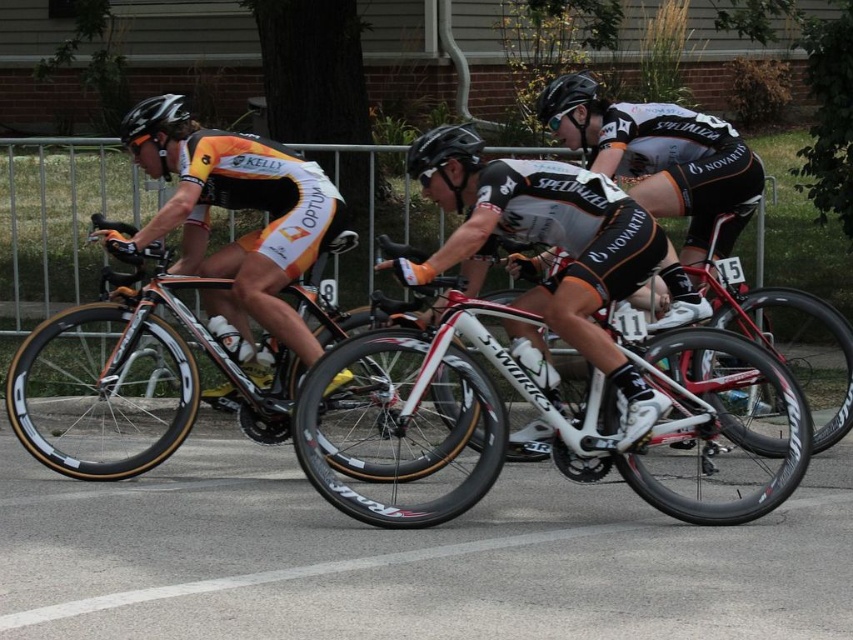
Question: Can you confirm if orange/white jersey at left is positioned to the right of black matte bicycle helmet at center?

Choices:
 (A) yes
 (B) no

Answer: (B)

Question: Is orange/white jersey at left wider than black matte helmet at center?

Choices:
 (A) no
 (B) yes

Answer: (B)

Question: Is shiny metallic bicycle at center to the left of white and black cycling jersey at center from the viewer's perspective?

Choices:
 (A) no
 (B) yes

Answer: (B)

Question: Which point is closer to the camera?

Choices:
 (A) white glossy bicycle at center
 (B) black matte helmet at upper left
 (C) black matte helmet at center

Answer: (A)

Question: Among these points, which one is farthest from the camera?

Choices:
 (A) (178, 113)
 (B) (468, 141)
 (C) (390, 477)

Answer: (A)

Question: Which object is closer to the camera taking this photo?

Choices:
 (A) white and black cycling jersey at center
 (B) black matte bicycle helmet at center
 (C) shiny metallic bicycle at center
 (D) black matte helmet at center

Answer: (A)